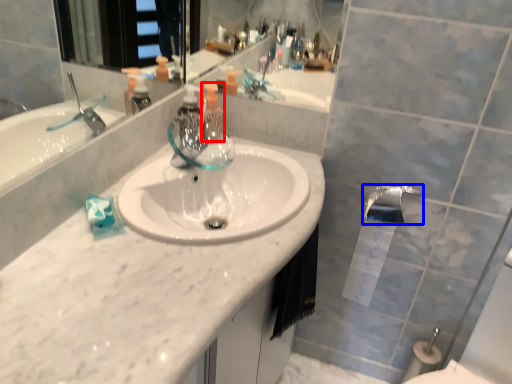
Question: Among these objects, which one is nearest to the camera, soap dispenser (highlighted by a red box) or tap (highlighted by a blue box)?

Choices:
 (A) soap dispenser
 (B) tap

Answer: (B)